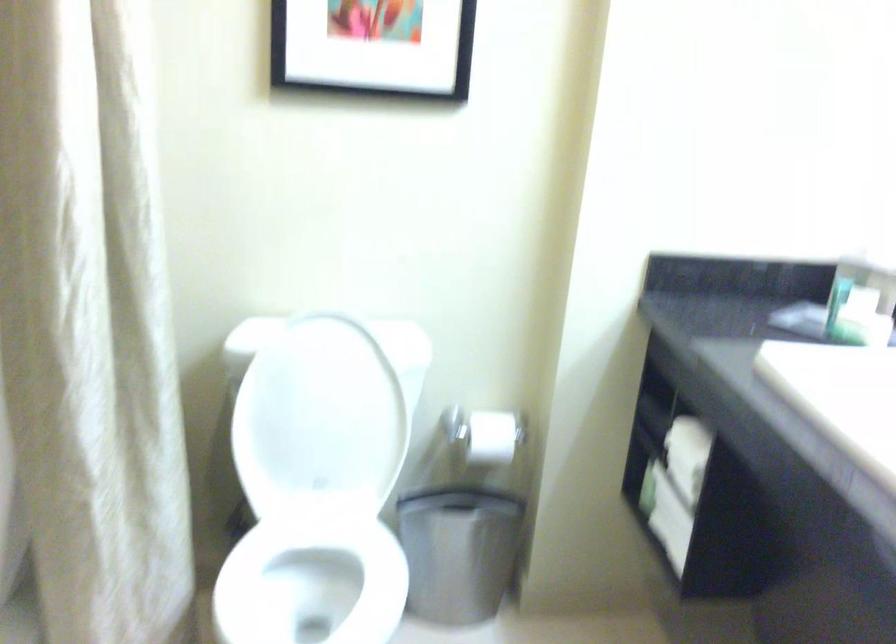
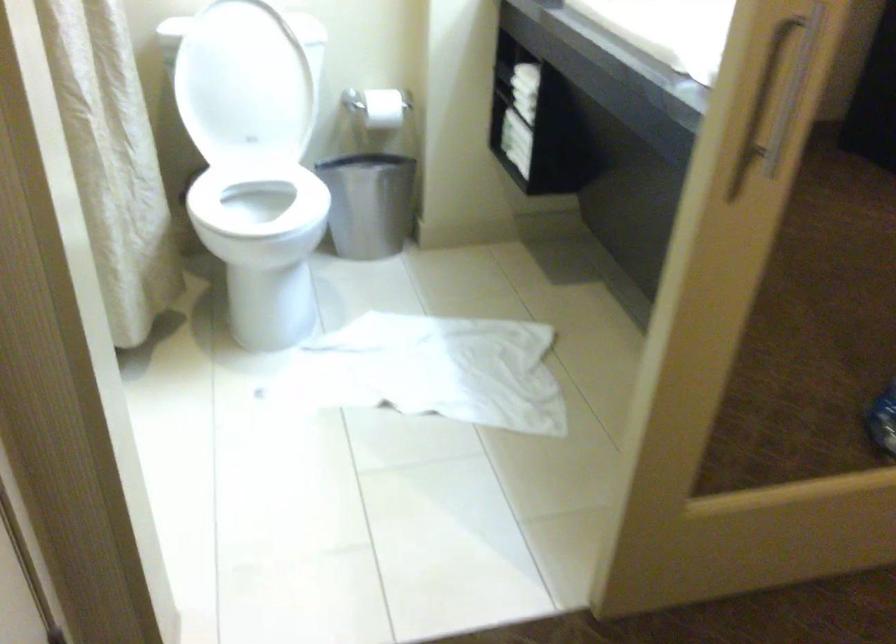
Where in the second image is the point corresponding to (x=313, y=339) from the first image?

(231, 15)